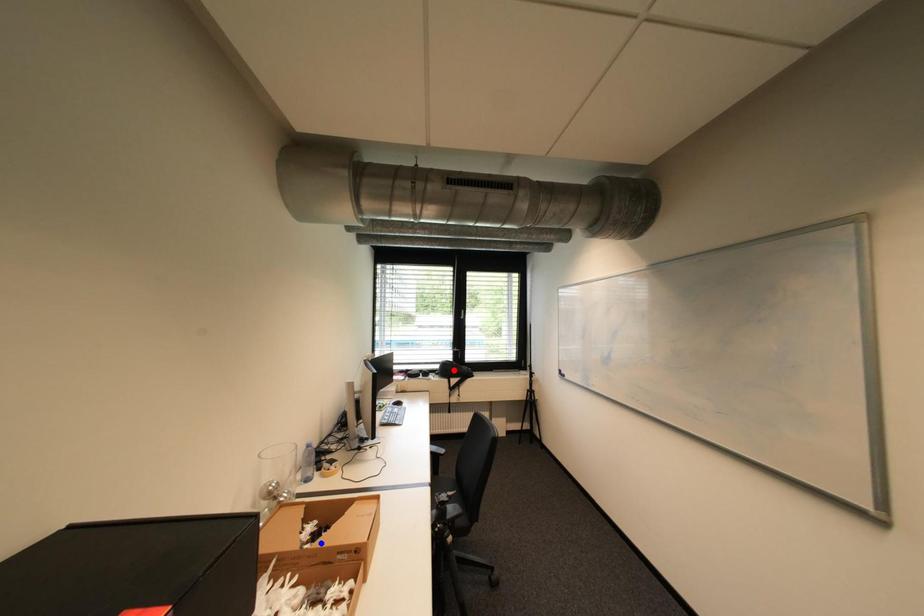
Question: Which of the two points in the image is closer to the camera?

Choices:
 (A) Blue point is closer.
 (B) Red point is closer.

Answer: (A)